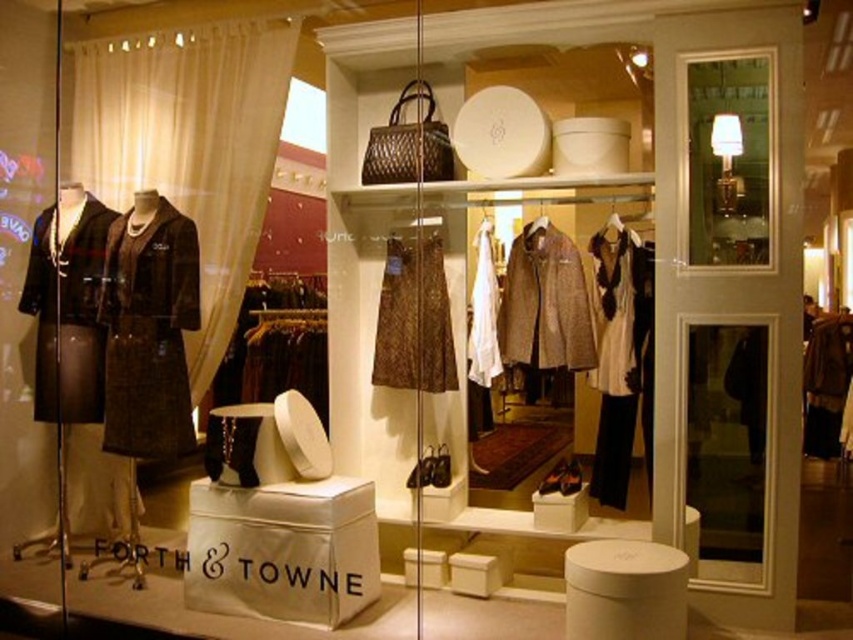
What are the coordinates of the brown textured coat at left in the display?

The brown textured coat at left is located at coordinates point (149, 330).

You are standing in front of the retail display at Forth and Towne. You see two points marked in the image. The first point is at coordinate point (628, 230) and the second point is at coordinate point (393, 369). Which point is closer to you?

Point (628, 230) is in front of point (393, 369), so the first point is closer to you.

You are a customer looking at the retail display. You want to know if the beige fabric curtain at left is positioned above or below the matte gold lamp at upper right. Based on the scene description, what is the relationship between their positions?

The beige fabric curtain at left is located below the matte gold lamp at upper right according to the description.